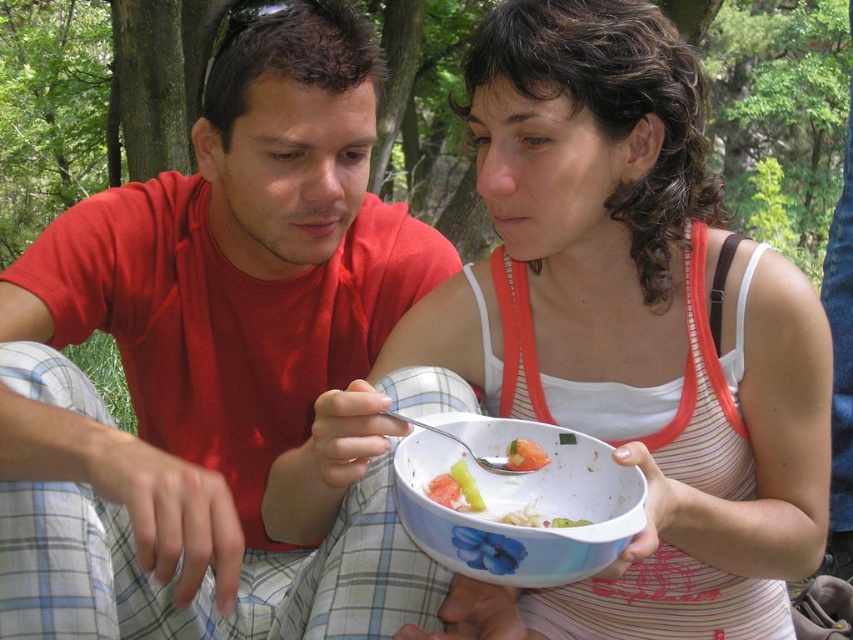
You are standing at the point labeled as point (312, 376) and want to walk towards the point labeled as point (618, 536). Which direction should you head?

Since point (312, 376) is behind point (618, 536), you should move forward towards point (618, 536).

You are standing at the point with coordinates point (527, 484) and want to walk towards the point with coordinates point (492, 72). Which direction should you face to move towards it?

You should face north because point (492, 72) is behind point (527, 484), meaning it is in the northern direction.